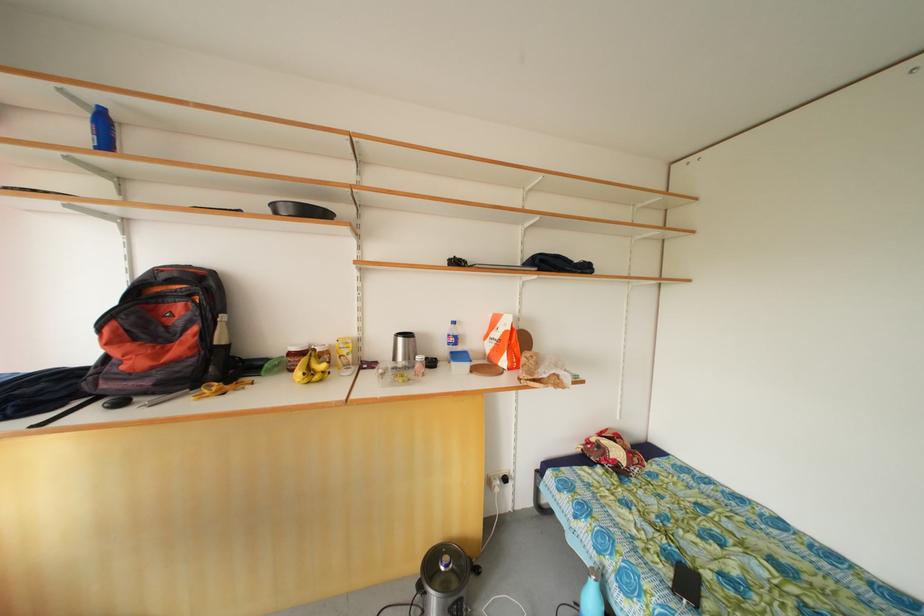
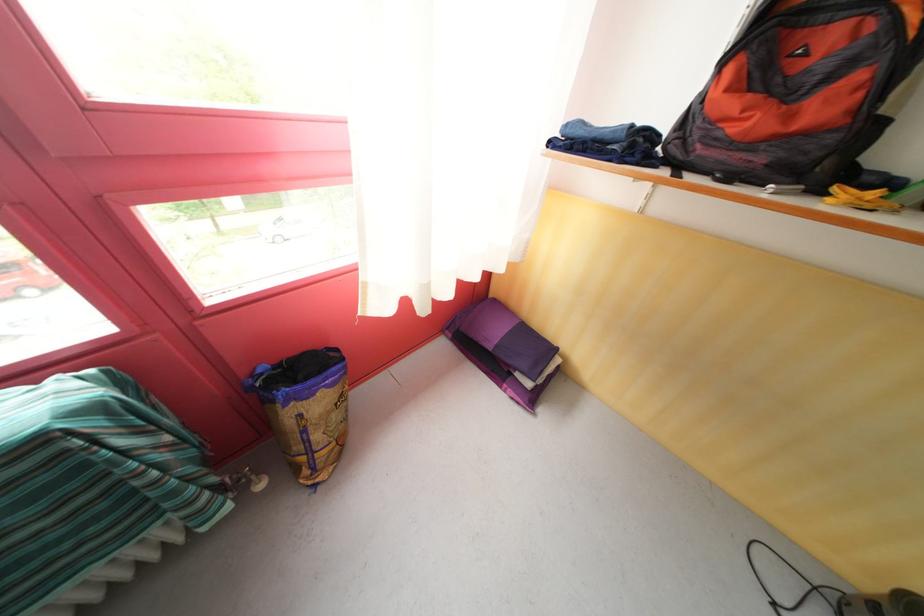
The point at (137, 382) is marked in the first image. Where is the corresponding point in the second image?

(736, 151)